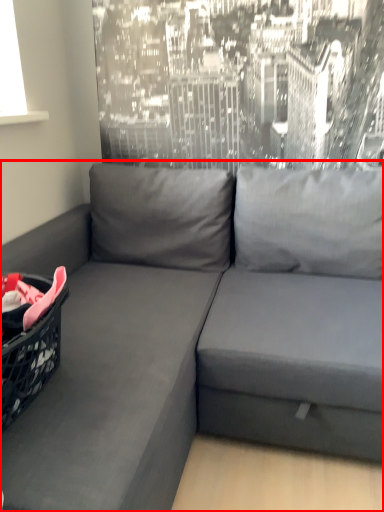
Question: Considering the relative positions of studio couch (annotated by the red box) and basket in the image provided, where is studio couch (annotated by the red box) located with respect to the staircase?

Choices:
 (A) left
 (B) right

Answer: (B)